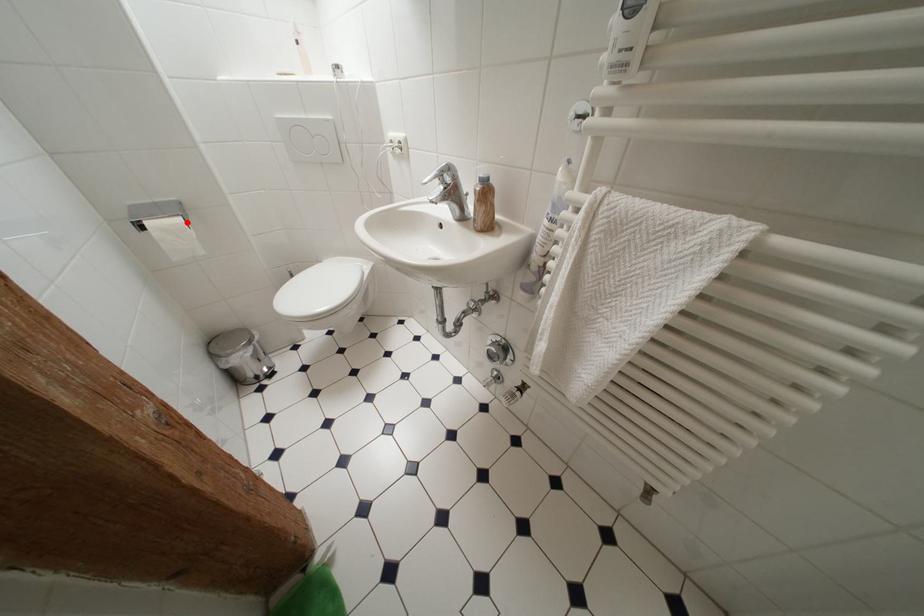
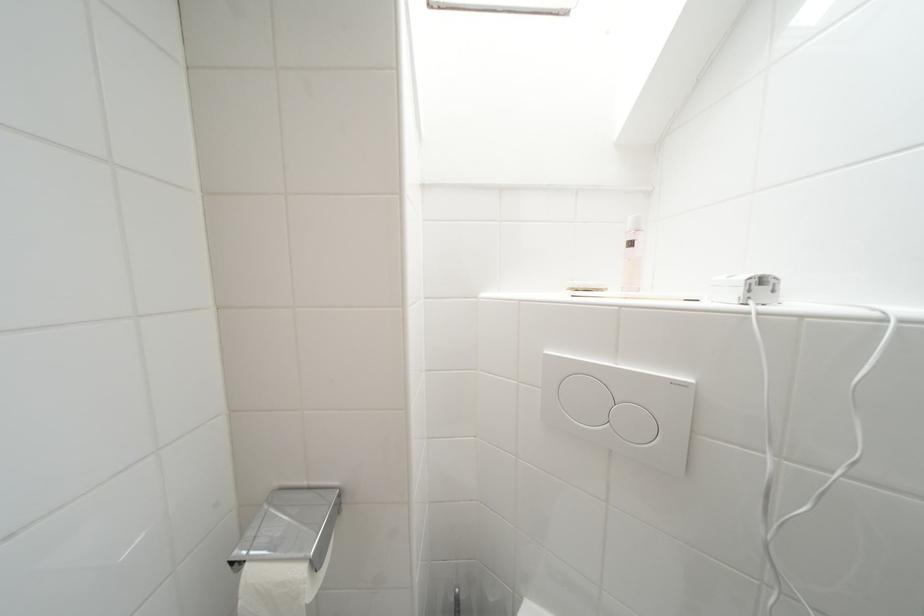
The point at the highlighted location is marked in the first image. Where is the corresponding point in the second image?

(309, 575)